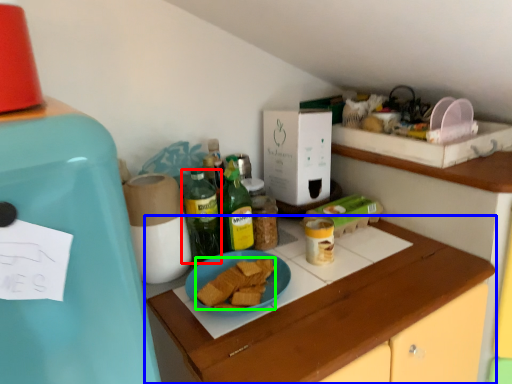
Question: Considering the real-world distances, which object is farthest from bottle (highlighted by a red box)? cabinetry (highlighted by a blue box) or food (highlighted by a green box)?

Choices:
 (A) cabinetry
 (B) food

Answer: (A)